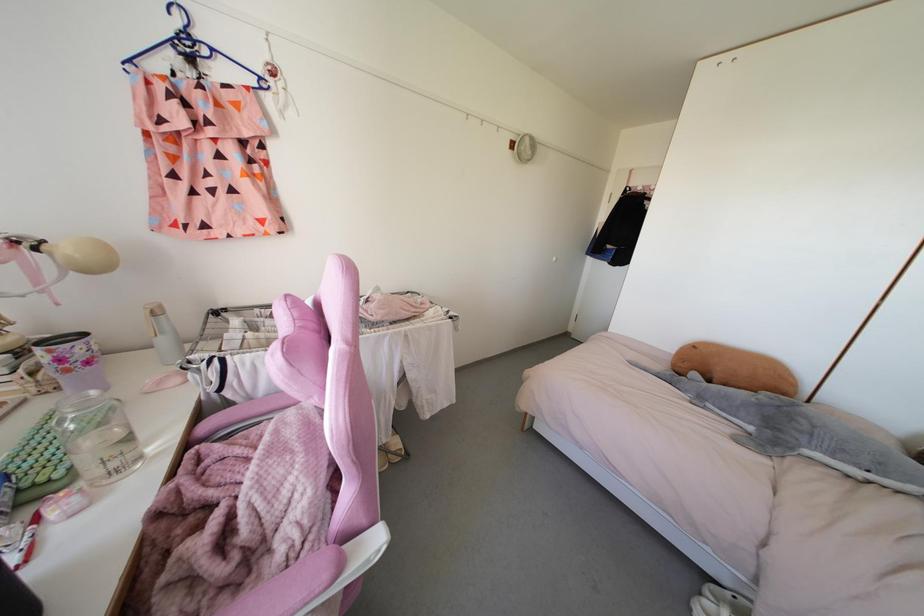
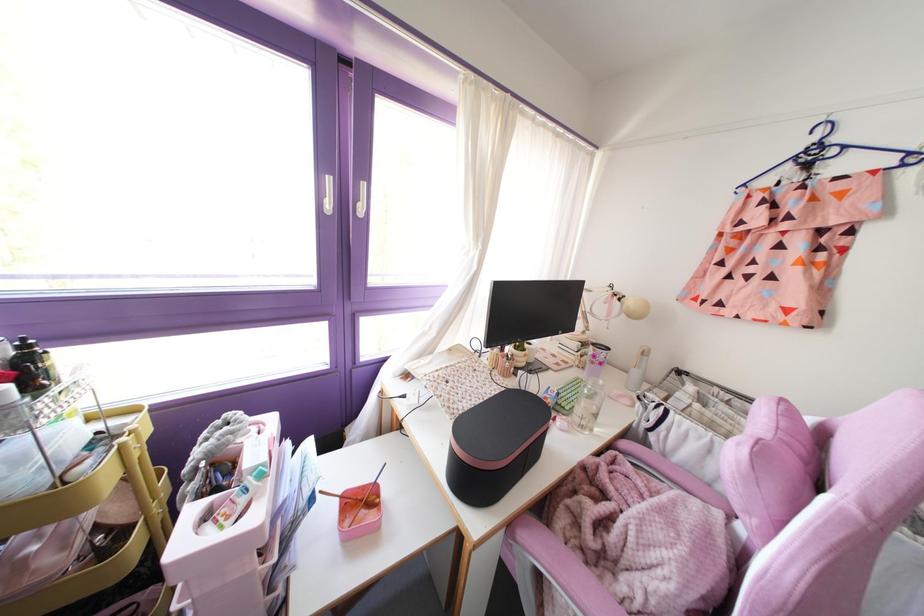
Where in the second image is the point corresponding to the point at 252,543 from the first image?

(610, 553)